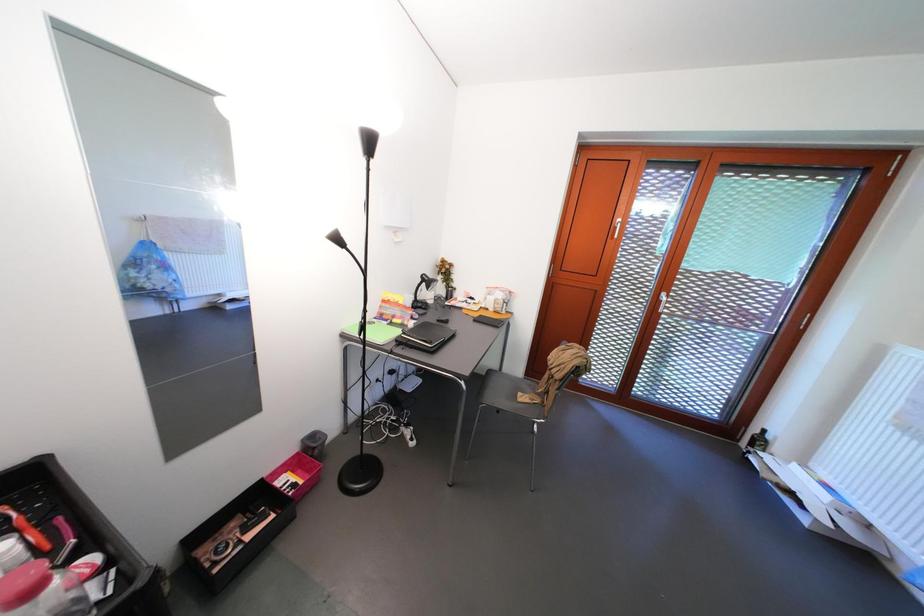
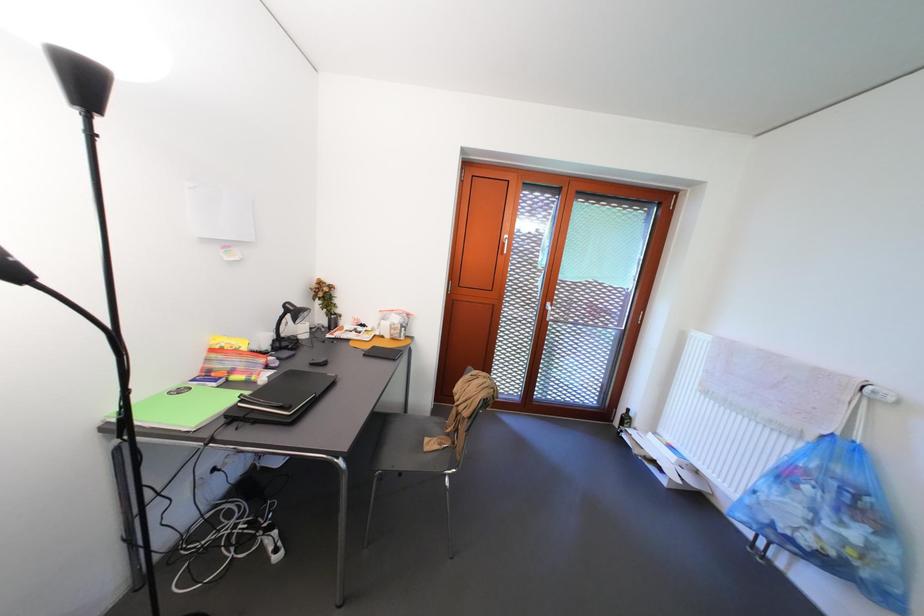
The images are taken continuously from a first-person perspective. In which direction are you moving?

The movement direction of the cameraman is right, forward.